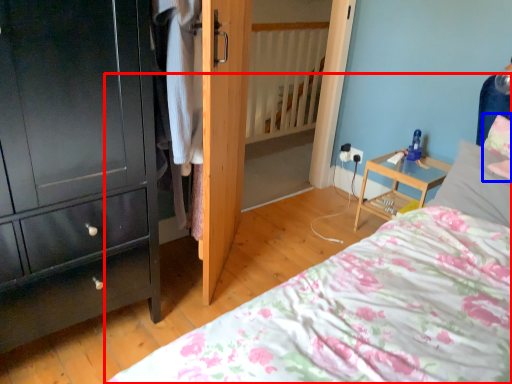
Question: Which object appears farthest to the camera in this image, bed (highlighted by a red box) or pillow (highlighted by a blue box)?

Choices:
 (A) bed
 (B) pillow

Answer: (B)